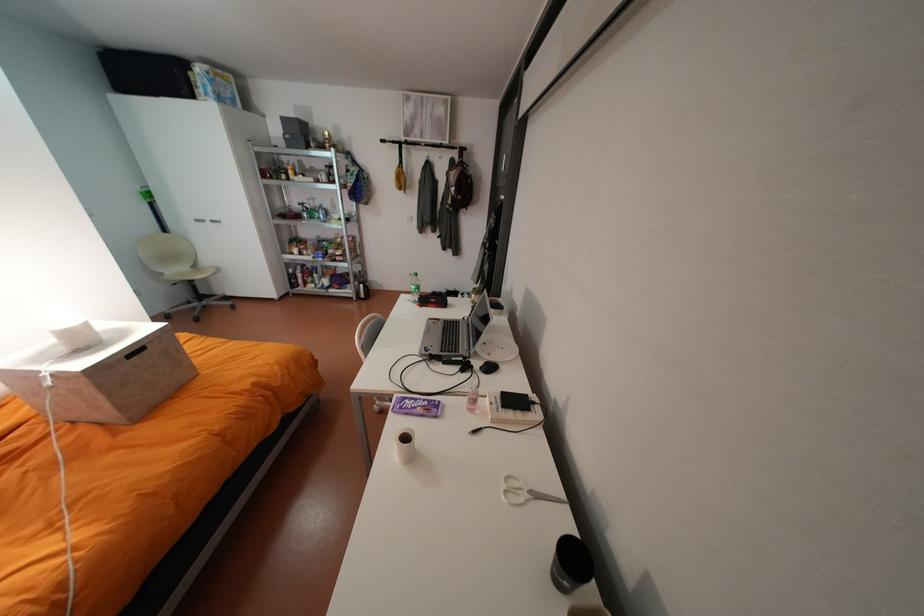
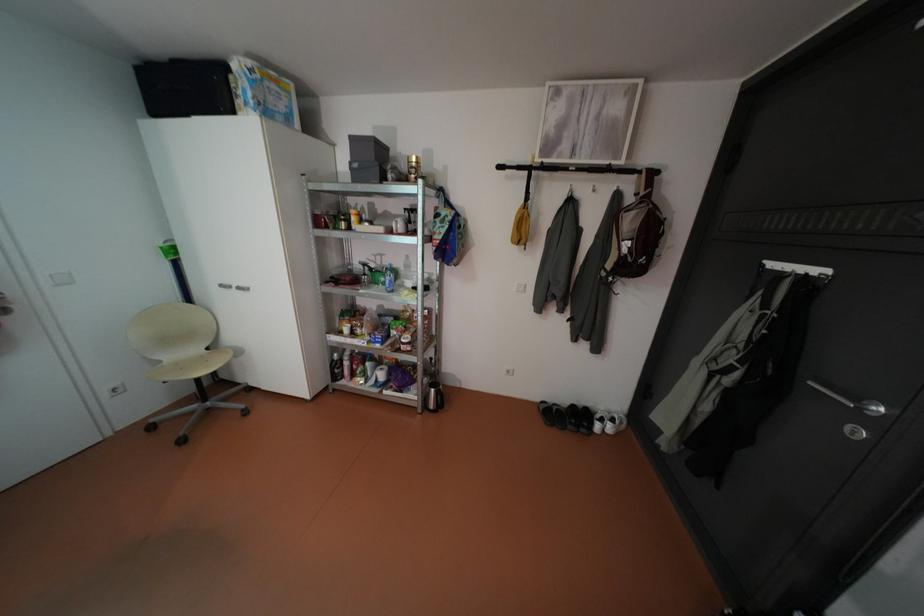
In the second image, find the point that corresponds to point 371,294 in the first image.

(441, 405)